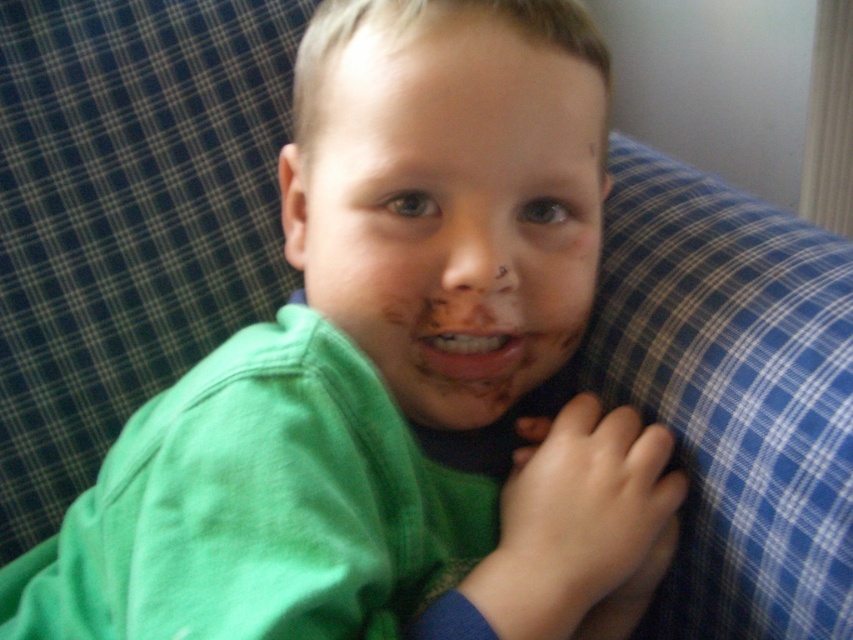
The child has two chocolate areas on their face. The chocolate matte face at center and the smooth chocolate mouth at center. How far apart are these two chocolate areas?

The chocolate matte face at center and the smooth chocolate mouth at center are 2.97 inches apart.

Based on the photo, you are a photographer trying to capture the child in the image. You want to focus on the chocolate matte face at center and the smooth chocolate mouth at center. Which object should you adjust your camera focus to first to ensure both are in focus?

The chocolate matte face at center is closer to the viewer than the smooth chocolate mouth at center, so you should focus on the chocolate matte face at center first to ensure both are in focus.